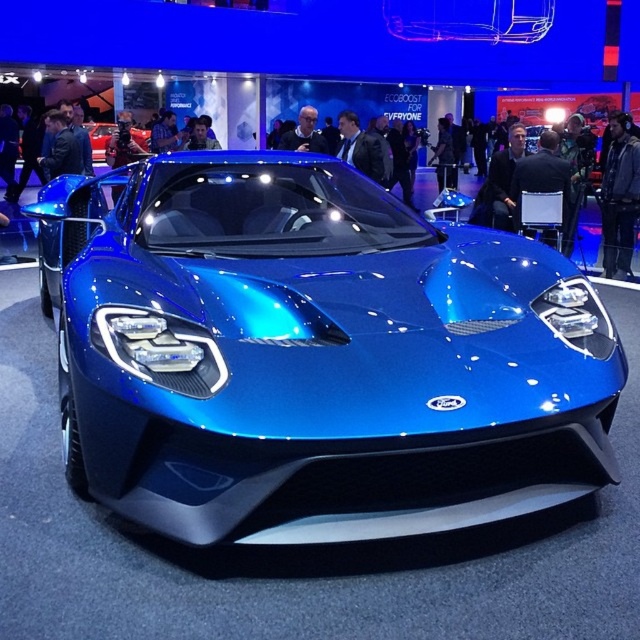
Between metallic blue sports car at center and metallic blue car at center, which one has less height?

metallic blue car at center is shorter.

Between metallic blue sports car at center and metallic blue car at center, which one is positioned lower?

metallic blue sports car at center is lower down.

Which is in front, point (116, 428) or point (92, 145)?

Point (116, 428)

Identify the location of metallic blue sports car at center. (314, 355).